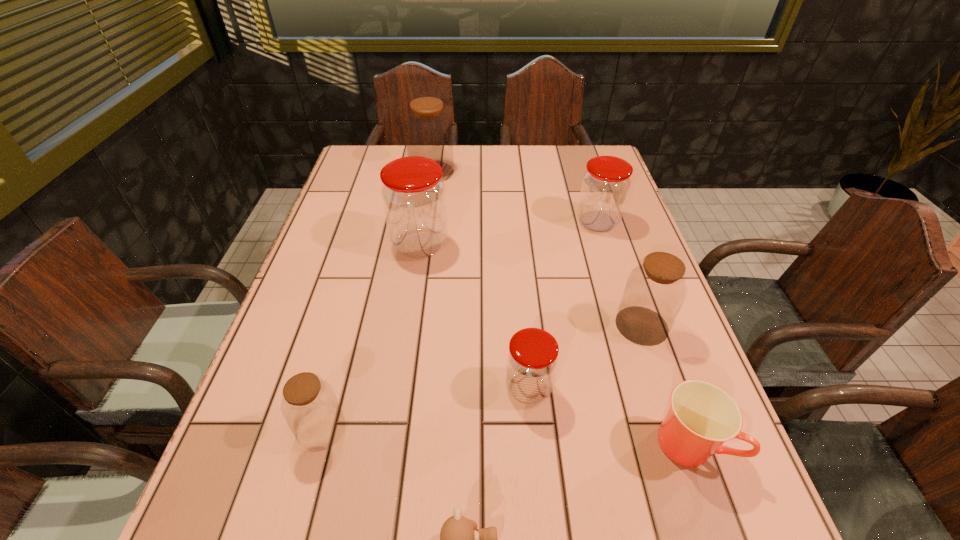
This screenshot has height=540, width=960. In order to click on the farthest object in this screenshot , I will do `click(428, 131)`.

Find the location of a particular element. This screenshot has height=540, width=960. the farthest brown jar is located at coordinates (428, 131).

Identify the location of the biggest red jar. (413, 194).

Where is `the second smallest red jar`? Image resolution: width=960 pixels, height=540 pixels. the second smallest red jar is located at coordinates (605, 186).

The image size is (960, 540). Find the location of `the third nearest jar`. the third nearest jar is located at coordinates (655, 290).

Where is `the rightmost brown jar`? The width and height of the screenshot is (960, 540). the rightmost brown jar is located at coordinates (655, 290).

Where is `the smallest brown jar`? This screenshot has width=960, height=540. the smallest brown jar is located at coordinates (309, 405).

Identify the location of the leftmost object. This screenshot has height=540, width=960. (309, 405).

Where is `the fourth jar from left to right`? the fourth jar from left to right is located at coordinates pyautogui.click(x=532, y=359).

Where is `the second red jar from right to left`? This screenshot has width=960, height=540. the second red jar from right to left is located at coordinates (532, 359).